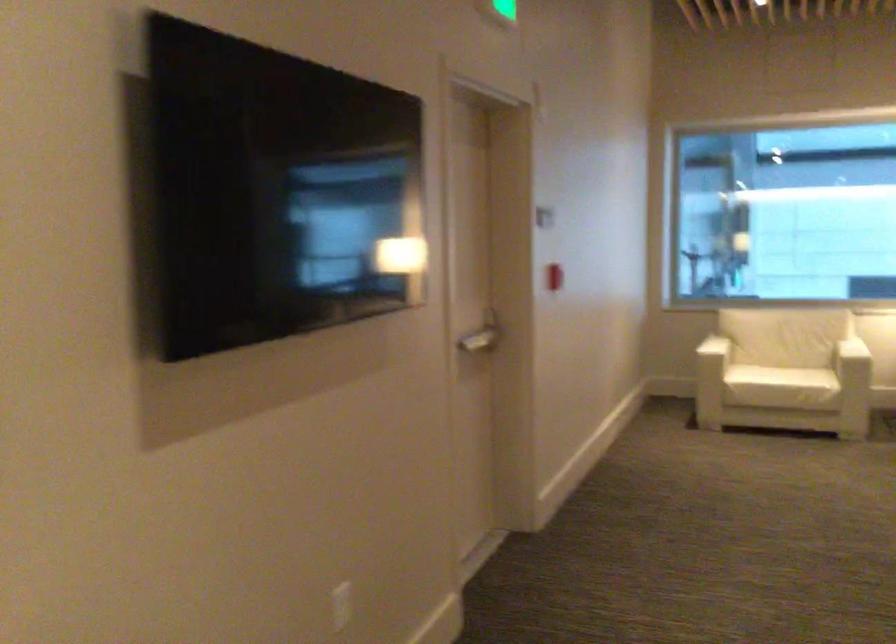
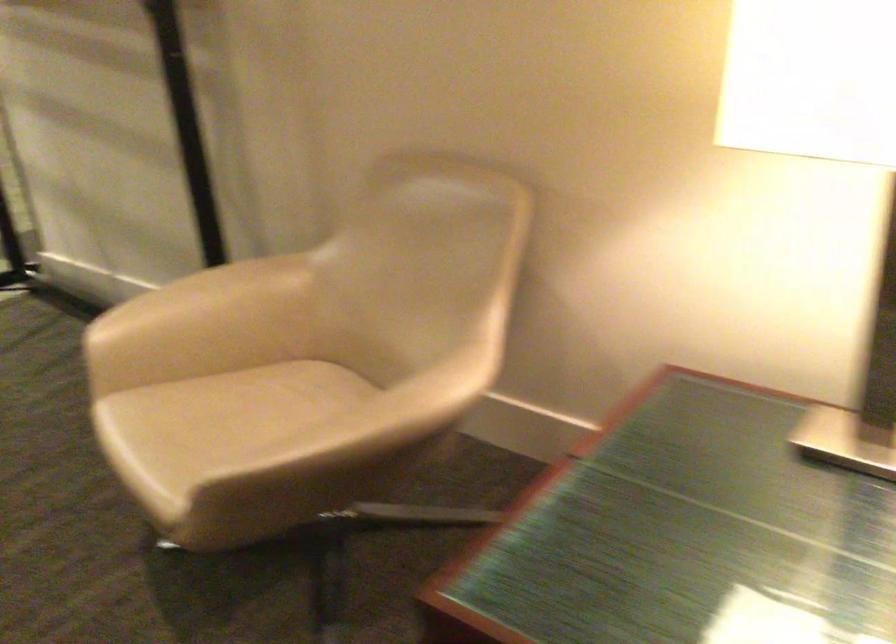
Based on the continuous images, in which direction is the camera rotating?

The rotation direction of the camera is left-down.